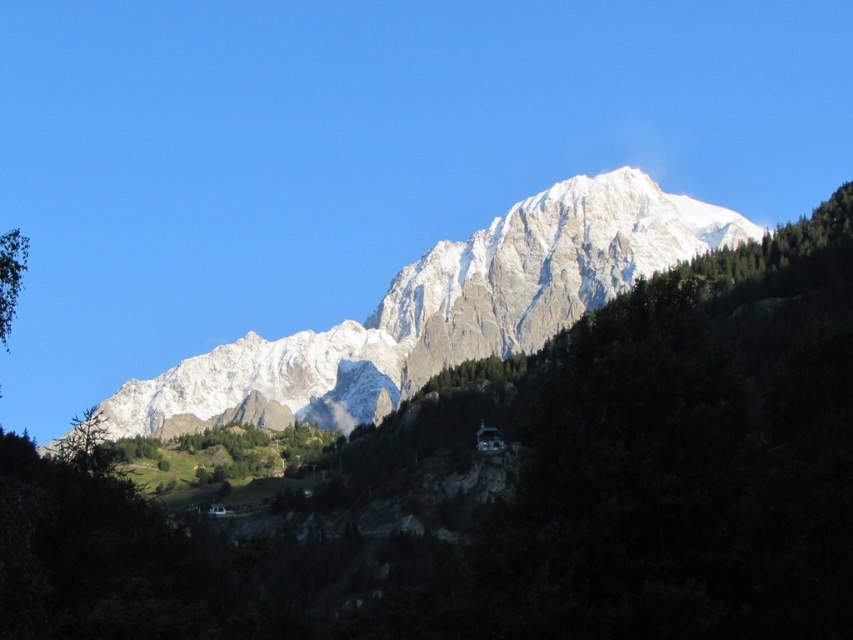
Question: Which object is closer to the camera taking this photo?

Choices:
 (A) white crystalline mountain range at center
 (B) green leafy tree at left

Answer: (B)

Question: Does white crystalline mountain range at center have a lesser width compared to green leafy tree at left?

Choices:
 (A) no
 (B) yes

Answer: (A)

Question: Is white crystalline mountain range at center bigger than green leafy tree at left?

Choices:
 (A) no
 (B) yes

Answer: (B)

Question: Considering the relative positions of white crystalline mountain range at center and green leafy tree at left in the image provided, where is white crystalline mountain range at center located with respect to green leafy tree at left?

Choices:
 (A) left
 (B) right

Answer: (B)

Question: Which point is farther to the camera?

Choices:
 (A) white crystalline mountain range at center
 (B) green leafy tree at left

Answer: (A)